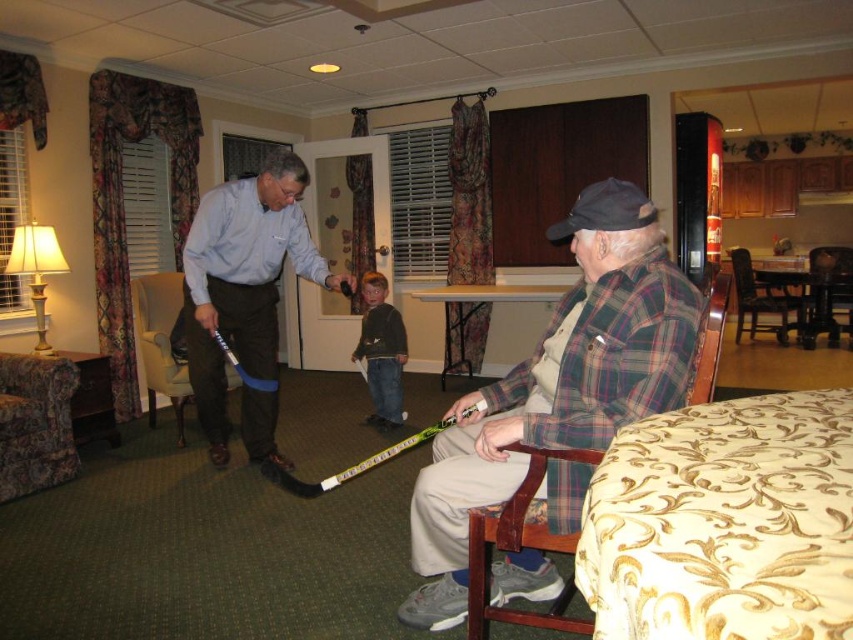
You are standing in the room and want to move from the wooden armchair at lower center to the brown wooden chair at right. Which direction should you move to reach it?

The wooden armchair at lower center is located below the brown wooden chair at right, so you should move upward to reach the brown wooden chair at right.

You are a delivery person who needs to place a small package on the wooden armchair at left or the dark gray fleece jacket at center. Which object can you place the package on without it falling off?

The wooden armchair at left has a greater height compared to the dark gray fleece jacket at center, so placing the package on the wooden armchair at left would be more stable and less likely to fall off.